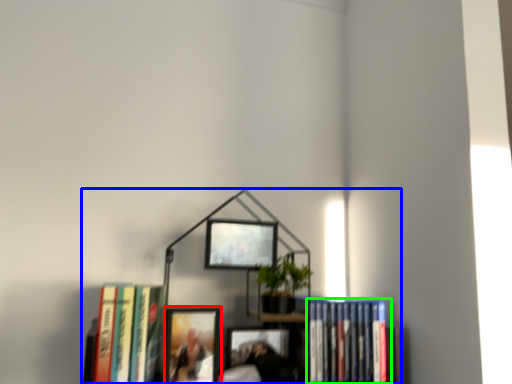
Question: Based on their relative distances, which object is nearer to picture frame (highlighted by a red box)? Choose from bookcase (highlighted by a blue box) and book (highlighted by a green box).

Choices:
 (A) bookcase
 (B) book

Answer: (A)